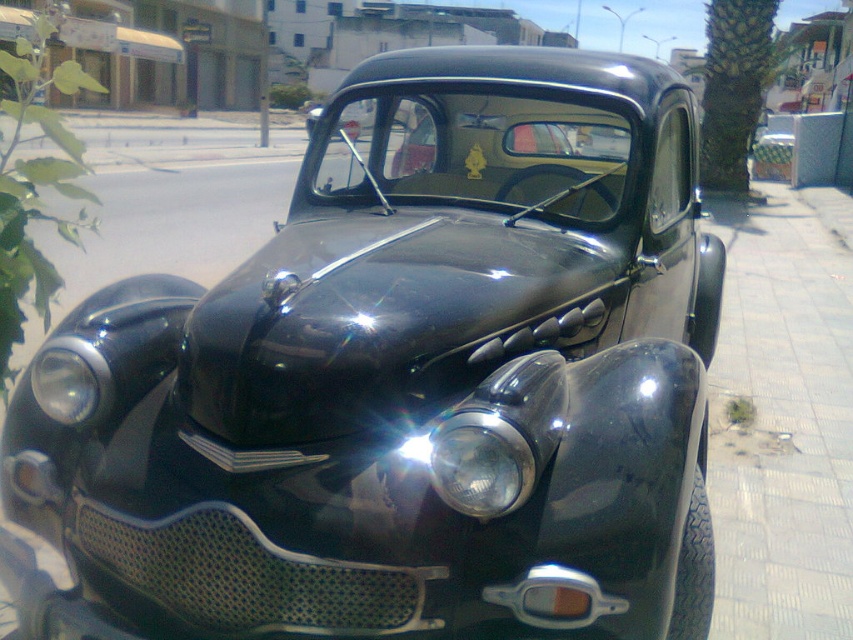
Is glossy plastic headlight at center to the right of matte black headlight at center from the viewer's perspective?

Correct, you'll find glossy plastic headlight at center to the right of matte black headlight at center.

Who is more forward, [477,490] or [45,388]?

Point [477,490] is more forward.

Locate an element on the screen. Image resolution: width=853 pixels, height=640 pixels. glossy plastic headlight at center is located at coordinates (474, 461).

Is green leafy palm tree at right positioned at the back of matte black headlight at center?

That is True.

Is point (705, 61) positioned after point (73, 380)?

Yes, point (705, 61) is farther from viewer.

Locate an element on the screen. The width and height of the screenshot is (853, 640). green leafy palm tree at right is located at coordinates (733, 88).

From the picture: Is green leafy palm tree at right to the right of glossy plastic headlight at center from the viewer's perspective?

Yes, green leafy palm tree at right is to the right of glossy plastic headlight at center.

How far apart are green leafy palm tree at right and glossy plastic headlight at center?

55.01 feet

Which is behind, point (769, 10) or point (434, 467)?

The point (769, 10) is more distant.

This screenshot has width=853, height=640. I want to click on green leafy palm tree at right, so click(733, 88).